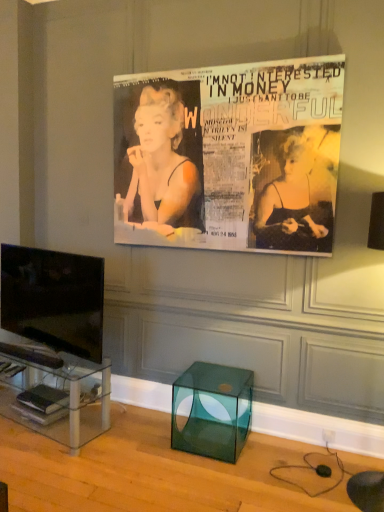
Image resolution: width=384 pixels, height=512 pixels. I want to click on vacant space in front of clear glass tv stand at lower left, so click(43, 468).